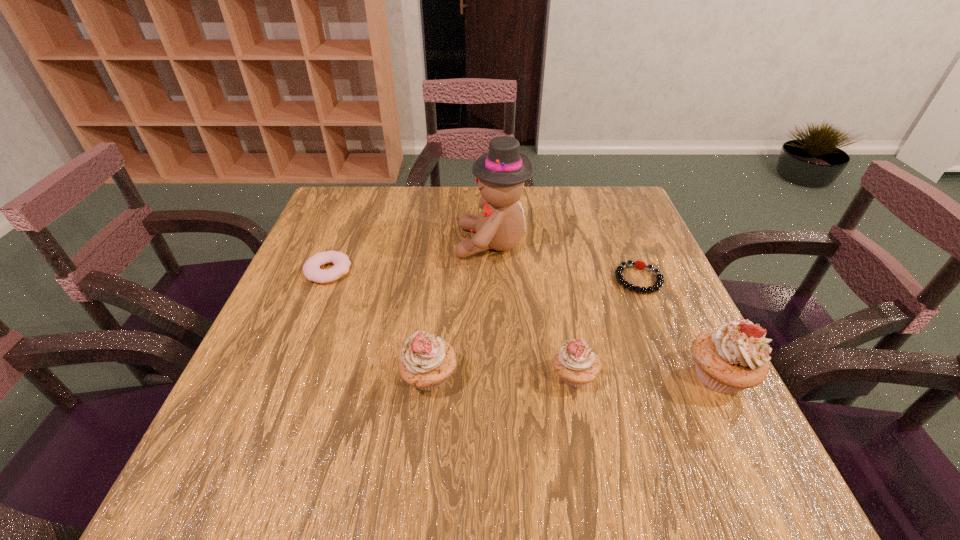
Identify the location of unoccupied area between the tallest object and the doughnut. The height and width of the screenshot is (540, 960). (410, 257).

At what (x,y) coordinates should I click in order to perform the action: click on blank region between the second tallest cupcake and the shortest object. Please return your answer as a coordinate pair (x, y). The image size is (960, 540). Looking at the image, I should click on (534, 328).

The image size is (960, 540). Identify the location of free space between the tallest cupcake and the doughnut. (523, 323).

The width and height of the screenshot is (960, 540). Identify the location of vacant area that lies between the third shortest object and the second tallest object. (647, 375).

At what (x,y) coordinates should I click in order to perform the action: click on vacant area that lies between the fourth tallest object and the leftmost cupcake. Please return your answer as a coordinate pair (x, y). The height and width of the screenshot is (540, 960). Looking at the image, I should click on (502, 376).

You are a GUI agent. You are given a task and a screenshot of the screen. Output one action in this format:
    pyautogui.click(x=<x>, y=<y>)
    Task: Click on the vacant space that's between the bracelet and the fourth tallest object
    The width and height of the screenshot is (960, 540).
    Given the screenshot: What is the action you would take?
    click(x=607, y=328)

Find the location of a particular element. vacant point located between the third shortest object and the tallest object is located at coordinates (533, 309).

Locate an element on the screen. vacant area between the rightmost cupcake and the rag_doll is located at coordinates (606, 309).

You are a GUI agent. You are given a task and a screenshot of the screen. Output one action in this format:
    pyautogui.click(x=<x>, y=<y>)
    Task: Click on the closest object to the shortest object
    This screenshot has height=540, width=960.
    Given the screenshot: What is the action you would take?
    pyautogui.click(x=733, y=357)

The height and width of the screenshot is (540, 960). What are the coordinates of `object that is the closest one to the doughnut` in the screenshot? It's located at (501, 172).